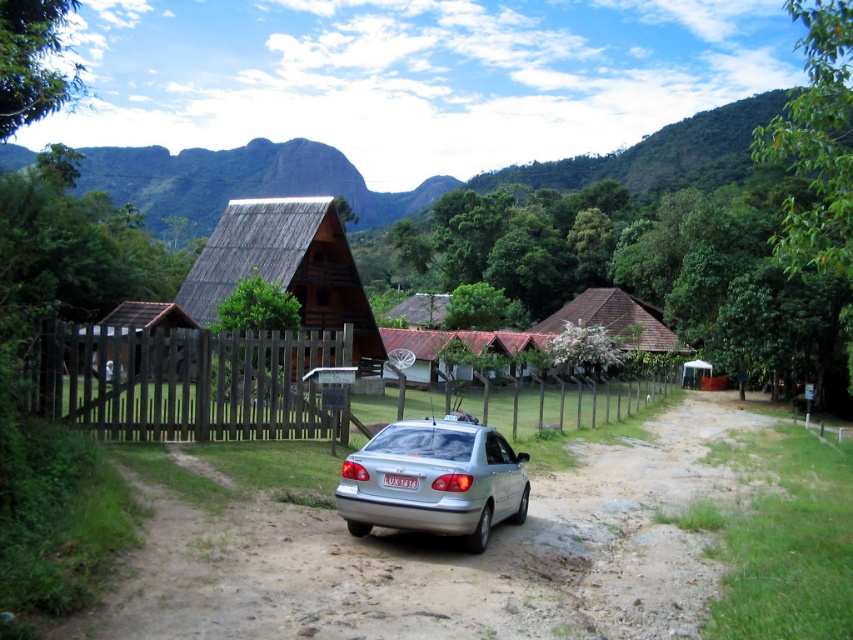
Question: Which point is farther to the camera?

Choices:
 (A) silver metallic car at center
 (B) brown wooden fence at center
 (C) brown thatched hut at center-right

Answer: (C)

Question: Which point is farther to the camera?

Choices:
 (A) (401, 484)
 (B) (405, 470)
 (C) (86, 637)

Answer: (A)

Question: Is brown wooden hut at upper center positioned at the back of brown thatched hut at center?

Choices:
 (A) yes
 (B) no

Answer: (A)

Question: Is brown wooden fence at center thinner than brown thatched hut at center-right?

Choices:
 (A) yes
 (B) no

Answer: (B)

Question: Is brown dirt track at center wider than silver metallic car at center?

Choices:
 (A) no
 (B) yes

Answer: (B)

Question: Which point appears farthest from the camera in this image?

Choices:
 (A) (294, 257)
 (B) (746, 99)

Answer: (B)